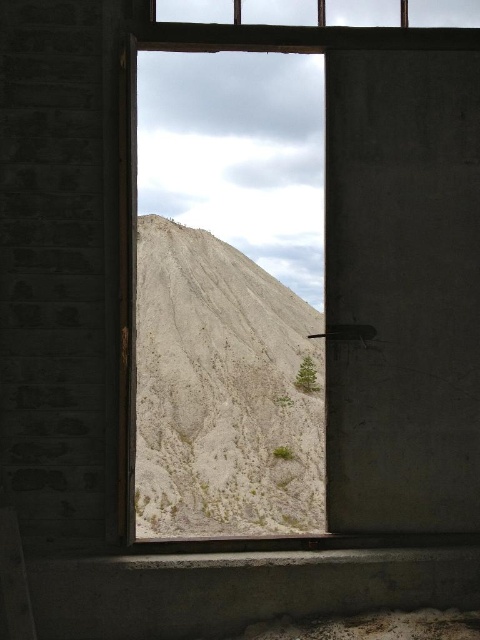
You are an architect designing a new window for the building. The matte concrete window at center currently has a width that is narrower than the white sandy hillside at center. If you want the new window to frame the hillside better, should you increase or decrease its width?

The matte concrete window at center has a width less than the white sandy hillside at center. To better frame the white sandy hillside at center, you should increase the window width so it can match or exceed the hillside width.

You are standing outside the building and want to look through the matte concrete window at center to see inside. Based on the scene description, is the window frame intact and in a condition that allows you to safely lean on it?

The window frame is made of wood with signs of wear and tear, including weathered or damaged areas, so it might not be safe to lean on it.

You are standing 10 feet away from the matte concrete window at center. Can you see the sandy hill through the window?

The matte concrete window at center is 15.76 feet away from the camera. Since you are standing 10 feet away from it, you are closer than the camera and should be able to see the sandy hill through the window.